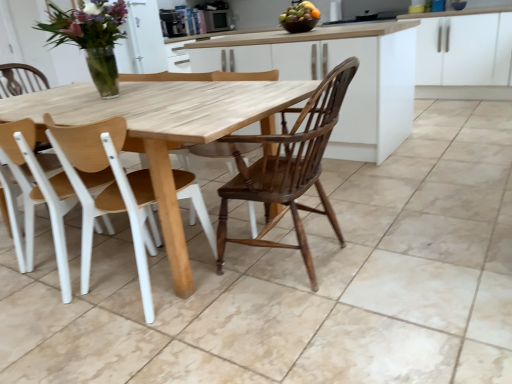
In order to click on free space that is in between wooden at center, the 1th chair when ordered from right to left, and white plastic chair at left, acting as the second chair starting from the right in this screenshot , I will do [98, 305].